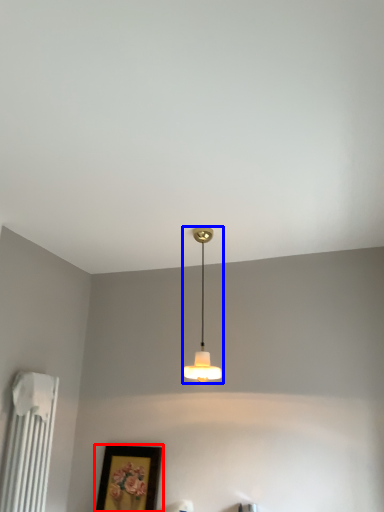
Question: Which point is further to the camera, picture frame (highlighted by a red box) or lamp (highlighted by a blue box)?

Choices:
 (A) picture frame
 (B) lamp

Answer: (A)